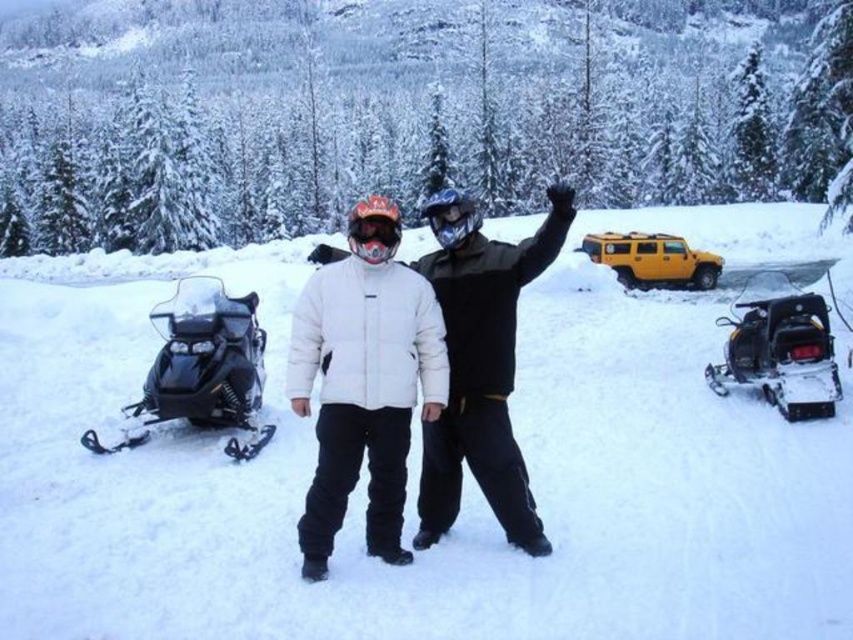
Question: Can you confirm if black plastic snowmobile at lower right is positioned above matte orange goggles at center?

Choices:
 (A) no
 (B) yes

Answer: (A)

Question: Among these objects, which one is farthest from the camera?

Choices:
 (A) matte orange goggles at center
 (B) white fluffy snow at center

Answer: (A)

Question: Considering the relative positions of black plastic snowmobile at lower right and matte orange goggles at center in the image provided, where is black plastic snowmobile at lower right located with respect to matte orange goggles at center?

Choices:
 (A) below
 (B) above

Answer: (A)

Question: Which object appears closest to the camera in this image?

Choices:
 (A) white fluffy snow at center
 (B) matte orange goggles at center
 (C) black plastic snowmobile at lower right
 (D) black plastic snowmobile at left

Answer: (A)

Question: Is black plastic snowmobile at left to the left of matte orange goggles at center from the viewer's perspective?

Choices:
 (A) no
 (B) yes

Answer: (B)

Question: Which point is closer to the camera?

Choices:
 (A) matte orange goggles at center
 (B) white matte jacket at center

Answer: (B)